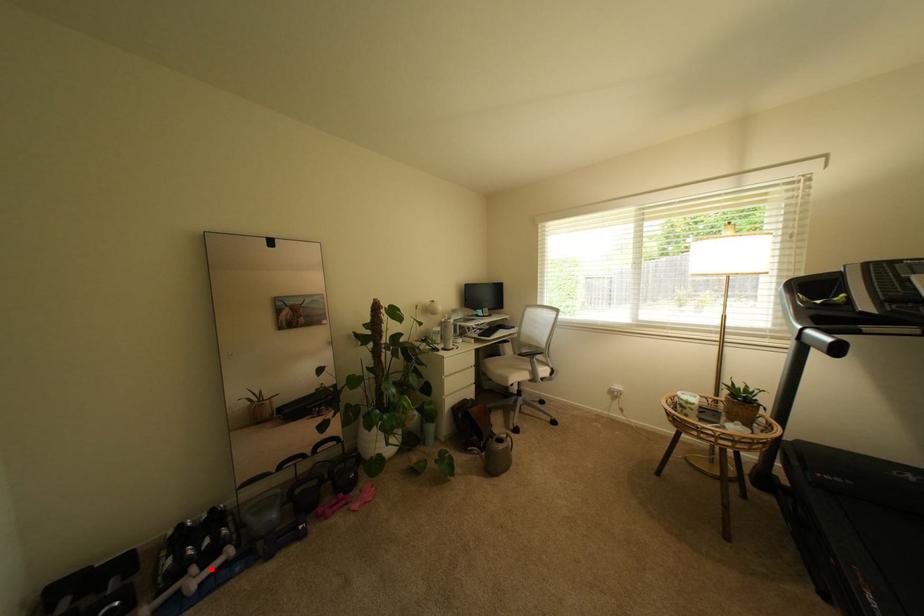
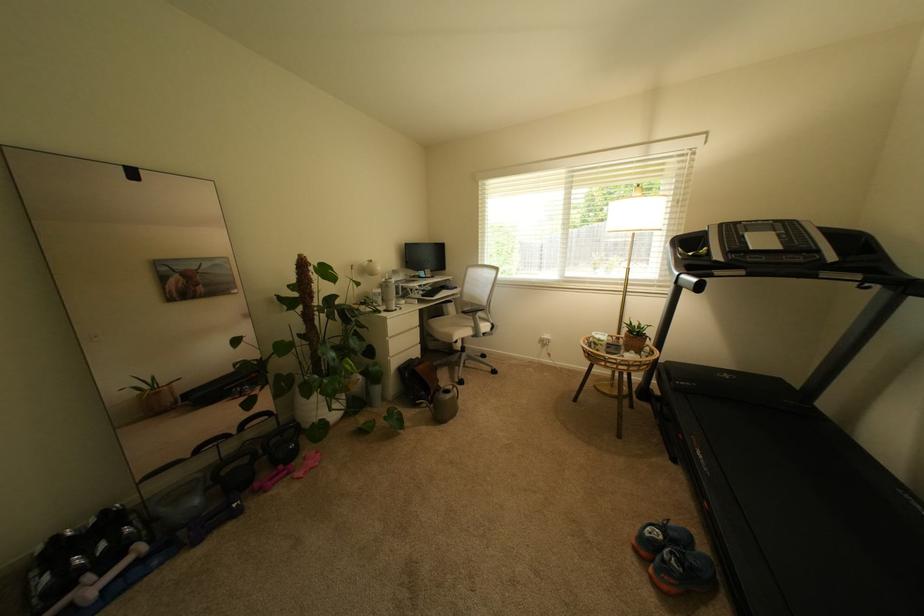
Find the pixel in the second image that matches the highlighted location in the first image.

(111, 573)